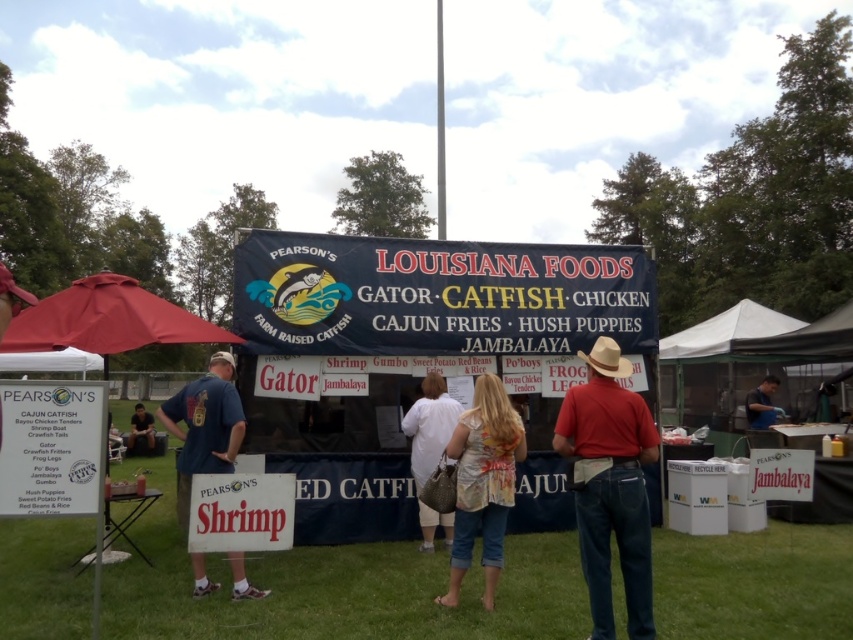
Is green grass at lower center closer to camera compared to white fabric shirt at center?

Yes, it is.

From the picture: Is green grass at lower center to the right of white fabric shirt at center from the viewer's perspective?

Yes, green grass at lower center is to the right of white fabric shirt at center.

I want to click on green grass at lower center, so click(x=347, y=593).

Where is `green grass at lower center`? The height and width of the screenshot is (640, 853). green grass at lower center is located at coordinates (347, 593).

Is blue shirt at center below matte blue shirt at center?

Actually, blue shirt at center is above matte blue shirt at center.

Is blue shirt at center positioned before matte blue shirt at center?

Yes.

At what (x,y) coordinates should I click in order to perform the action: click on blue shirt at center. Please return your answer as a coordinate pair (x, y). This screenshot has height=640, width=853. Looking at the image, I should click on (762, 404).

Measure the distance from denim shorts at center to blue shirt at center.

denim shorts at center is 21.82 feet away from blue shirt at center.

Where is `denim shorts at center`? Image resolution: width=853 pixels, height=640 pixels. denim shorts at center is located at coordinates (483, 483).

Locate an element on the screen. The height and width of the screenshot is (640, 853). denim shorts at center is located at coordinates (483, 483).